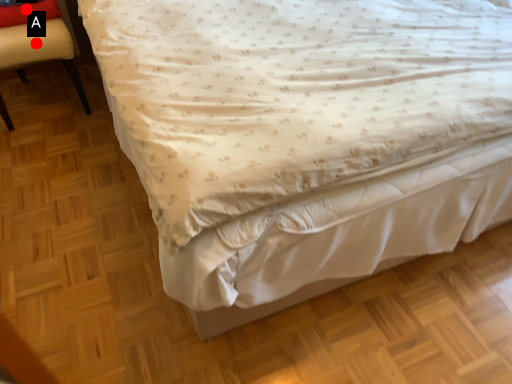
Question: Two points are circled on the image, labeled by A and B beside each circle. Which point is further to the camera?

Choices:
 (A) A is further
 (B) B is further

Answer: (B)